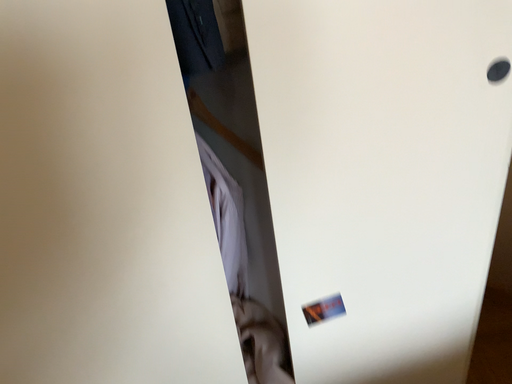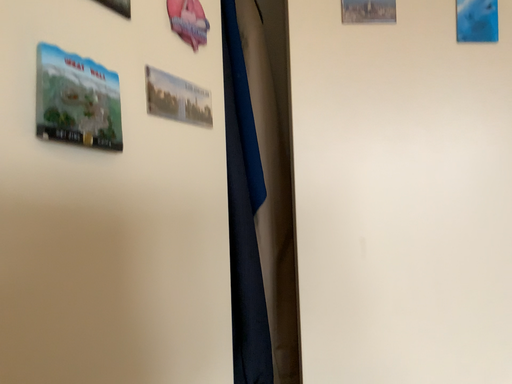
Question: How did the camera likely rotate when shooting the video?

Choices:
 (A) rotated downward
 (B) rotated upward

Answer: (B)